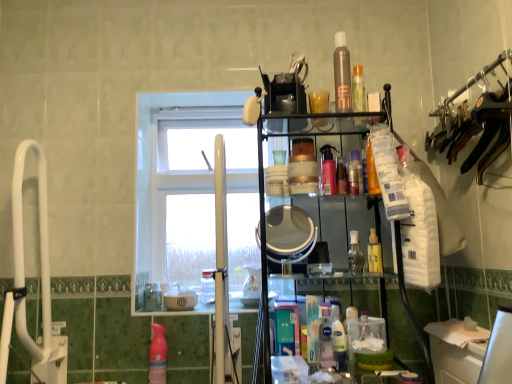
Question: Is translucent plastic spray bottle at center, the 4th toiletry in the top-to-bottom sequence, smaller than satin brown spray can at upper center, the 1th toiletry viewed from the top?

Choices:
 (A) no
 (B) yes

Answer: (B)

Question: Is translucent plastic spray bottle at center, the 4th toiletry in the top-to-bottom sequence, further to camera compared to satin brown spray can at upper center, positioned as the 6th toiletry in bottom-to-top order?

Choices:
 (A) no
 (B) yes

Answer: (B)

Question: Considering the relative positions of translucent plastic spray bottle at center, the 4th toiletry in the top-to-bottom sequence, and satin brown spray can at upper center, the 1th toiletry viewed from the top, in the image provided, is translucent plastic spray bottle at center, the 4th toiletry in the top-to-bottom sequence, in front of satin brown spray can at upper center, the 1th toiletry viewed from the top,?

Choices:
 (A) yes
 (B) no

Answer: (B)

Question: Does translucent plastic spray bottle at center, the 4th toiletry in the top-to-bottom sequence, have a lesser height compared to satin brown spray can at upper center, positioned as the 6th toiletry in bottom-to-top order?

Choices:
 (A) yes
 (B) no

Answer: (A)

Question: From the image's perspective, is translucent plastic spray bottle at center, acting as the 3th toiletry starting from the bottom, located beneath satin brown spray can at upper center, the 1th toiletry viewed from the top?

Choices:
 (A) yes
 (B) no

Answer: (A)

Question: Considering the relative positions of white glass window at center and clear glass bottle at center, the second toiletry when ordered from bottom to top, in the image provided, is white glass window at center to the left or to the right of clear glass bottle at center, the second toiletry when ordered from bottom to top,?

Choices:
 (A) right
 (B) left

Answer: (B)

Question: Considering the positions of white glass window at center and clear glass bottle at center, the second toiletry when ordered from bottom to top, in the image, is white glass window at center taller or shorter than clear glass bottle at center, the second toiletry when ordered from bottom to top,?

Choices:
 (A) short
 (B) tall

Answer: (B)

Question: Looking at their shapes, would you say white glass window at center is wider or thinner than clear glass bottle at center, marked as the fifth toiletry in a top-to-bottom arrangement?

Choices:
 (A) wide
 (B) thin

Answer: (A)

Question: Is point (231, 190) positioned closer to the camera than point (352, 241)?

Choices:
 (A) closer
 (B) farther

Answer: (B)

Question: In terms of height, does matte silver mirror at center look taller or shorter compared to translucent plastic spray bottle at lower center, arranged as the first cleaning product when viewed from the front?

Choices:
 (A) short
 (B) tall

Answer: (B)

Question: From a real-world perspective, is matte silver mirror at center positioned above or below translucent plastic spray bottle at lower center, arranged as the first cleaning product when viewed from the front?

Choices:
 (A) above
 (B) below

Answer: (A)

Question: Does point (280, 241) appear closer or farther from the camera than point (322, 332)?

Choices:
 (A) farther
 (B) closer

Answer: (A)

Question: Relative to translucent plastic spray bottle at lower center, arranged as the first cleaning product when viewed from the front, is matte silver mirror at center in front or behind?

Choices:
 (A) front
 (B) behind

Answer: (B)

Question: In terms of size, does pink glossy spray bottle at center, acting as the 5th toiletry starting from the bottom, appear bigger or smaller than white glass window at center?

Choices:
 (A) small
 (B) big

Answer: (A)

Question: In the image, is pink glossy spray bottle at center, marked as the second toiletry in a top-to-bottom arrangement, on the left side or the right side of white glass window at center?

Choices:
 (A) right
 (B) left

Answer: (A)